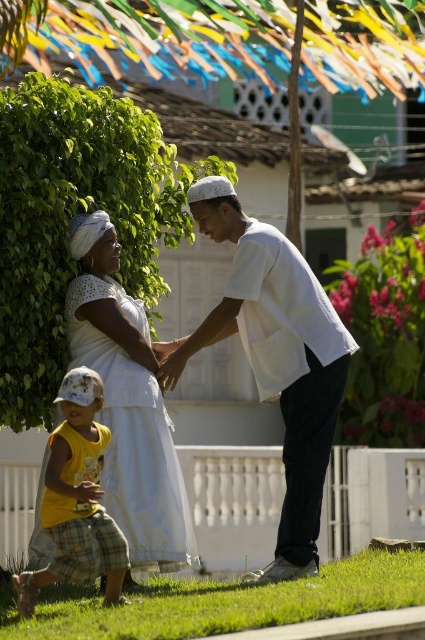
You are an architect designing a new residential building. You want to place a new window on the building so that it aligns with the green leafy tree at upper left. What are the coordinates where you should place the window?

The green leafy tree at upper left is located at coordinates point (73,216), so the window should be placed at those coordinates to align with it.

You are standing at the center of the image. Which direction should you look to see the green leafy tree at upper left?

You should look to the upper left direction to see the green leafy tree at upper left.